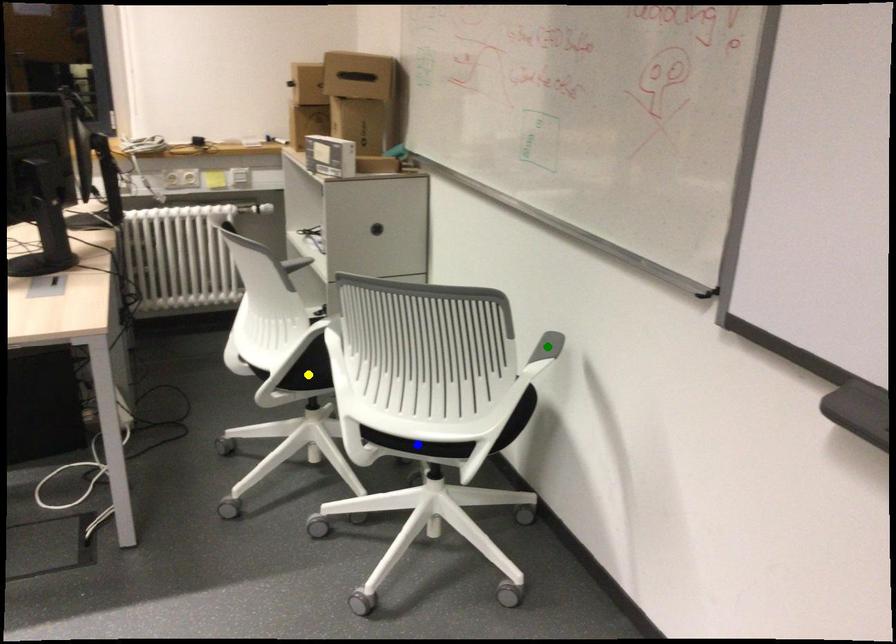
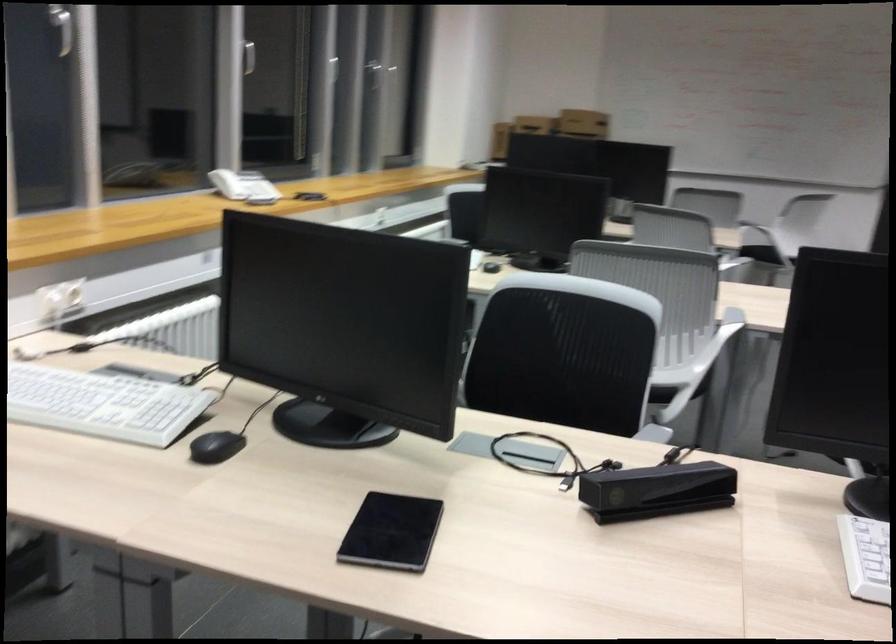
I am providing you with two images of the same scene from different viewpoints. Three points are marked in image1. Which point corresponds to a part or object that is occluded in image2?In image1, three points are marked. Which of them correspond to a part or object that is occluded in image2?Among the three points shown in image1, which one corresponds to a part or object that is no longer visible due to occlusion in image2?

yellow point, green point, blue point cannot be seen in image2.